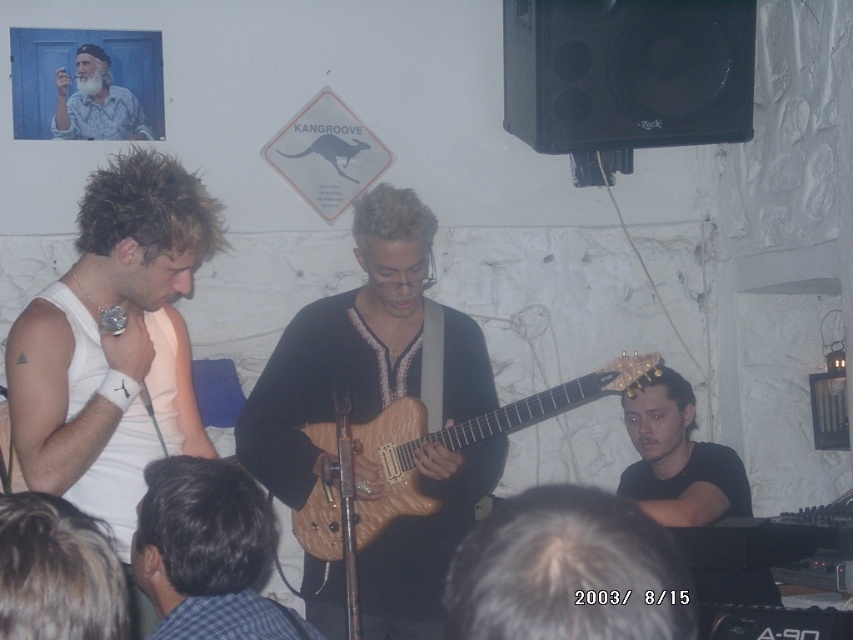
You are a photographer setting up for a live music shoot. You need to capture a closeup of the wooden guitar at center while also including the gray hair at lower center in the frame. Given that the distance between them is 19.09 inches, what is the minimum focal length lens you should use if your camera sensor has a diagonal measurement of 24mm? Assume the hyperfocal distance is not a factor and that the acceptable field of view requires both objects to be within the frame without cropping.

The wooden guitar at center is 19.09 inches from gray hair at lower center. To include both in the frame without cropping, the minimum focal length lens required can be calculated using the formula focal length equals sensor diagonal divided by subject distance. However, this requires converting units and knowing the shooting distance from the camera to the subjects, which isn not provided. Without additional information about the camera to subject distance, an exact focal length cannot be determined.

You are standing at the front of the venue and want to take a photo of the point at coordinates point (369, 582). The camera you have can focus up to 10 feet. Will the camera be able to focus on the point?

The distance of point (369, 582) from camera is 9.94 feet, which is within the camera focus range of up to 10 feet. Therefore, the camera will be able to focus on the point.